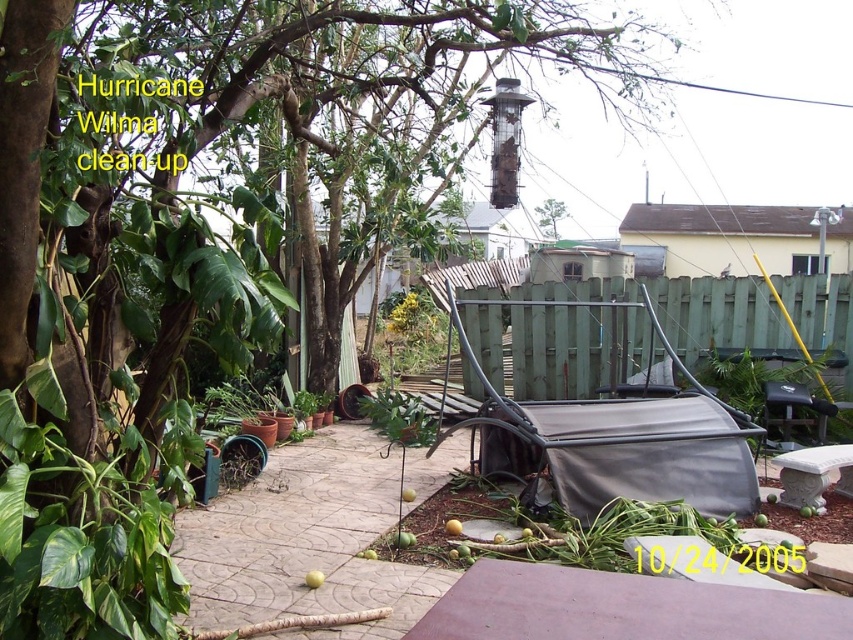
You are a landscape architect assessing the damage in the hurricane aftermath. You need to determine if the green wood fence at center can be repaired without removing the green leafy tree at upper center. Based on their widths, can the fence be fixed in its current position?

The green wood fence at center is wider than the green leafy tree at upper center. Since the fence is wider, it can likely be repaired without affecting the tree, as there is sufficient space between them.

You are a landscape architect assessing the hurricane damage. You need to determine if the green wood fence at center can block the view of the green leafy tree at upper center from the front yard. Can it?

The green wood fence at center is much taller than the green leafy tree at upper center, so it would block the view of the green leafy tree at upper center from the front yard.